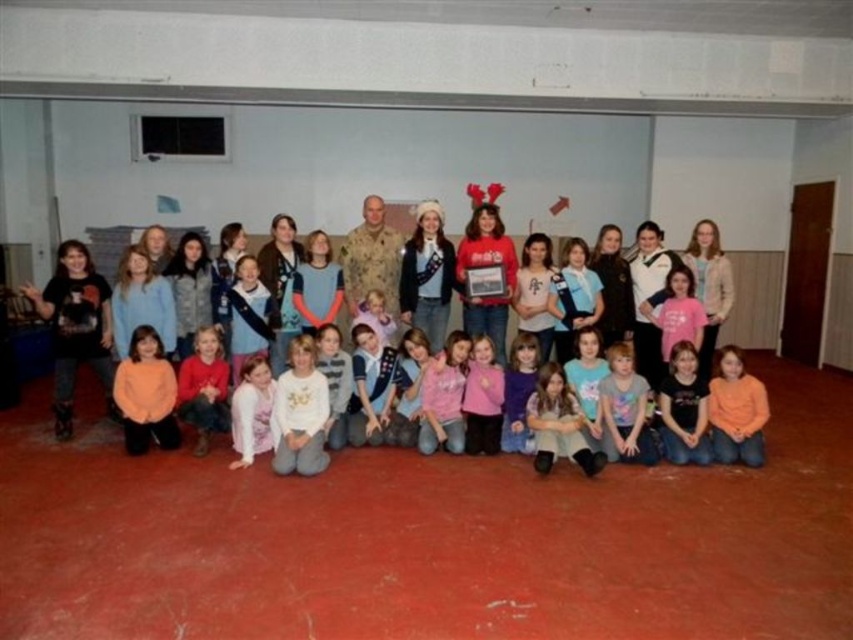
Can you confirm if orange fleece sweater at lower left is smaller than camouflage uniform at center?

Indeed, orange fleece sweater at lower left has a smaller size compared to camouflage uniform at center.

Between point (155, 333) and point (364, 280), which one is positioned behind?

The point (364, 280) is behind.

What are the coordinates of `orange fleece sweater at lower left` in the screenshot? It's located at (146, 394).

Can you confirm if camouflage uniform at center is shorter than black matte shirt at lower center?

No, camouflage uniform at center is not shorter than black matte shirt at lower center.

Can you confirm if camouflage uniform at center is positioned below black matte shirt at lower center?

Answer: Incorrect, camouflage uniform at center is not positioned below black matte shirt at lower center.

What do you see at coordinates (370, 259) in the screenshot? I see `camouflage uniform at center` at bounding box center [370, 259].

The image size is (853, 640). In order to click on camouflage uniform at center in this screenshot , I will do `click(370, 259)`.

Between orange fleece sweater at lower left and matte pink sweater at center, which one has less height?

matte pink sweater at center is shorter.

Does orange fleece sweater at lower left appear over matte pink sweater at center?

Yes, orange fleece sweater at lower left is above matte pink sweater at center.

Image resolution: width=853 pixels, height=640 pixels. In order to click on orange fleece sweater at lower left in this screenshot , I will do `click(146, 394)`.